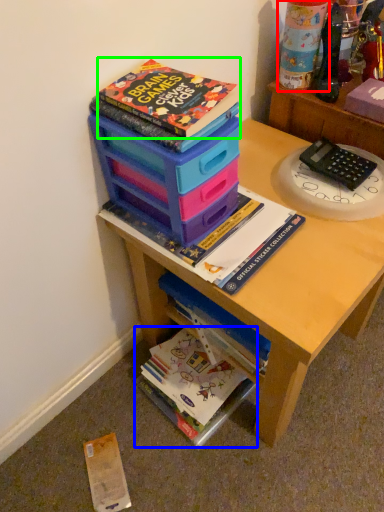
Question: Estimate the real-world distances between objects in this image. Which object is farther from toy (highlighted by a red box), book (highlighted by a blue box) or book (highlighted by a green box)?

Choices:
 (A) book
 (B) book

Answer: (A)